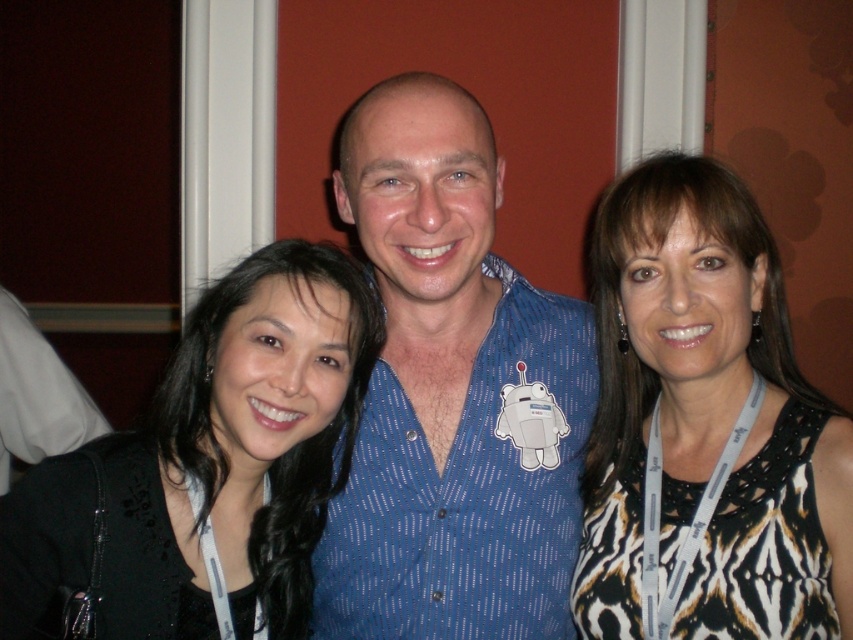
You are standing in front of the group photo and need to identify the clothing items. Which clothing item is positioned to the right of the other between the printed fabric dress at right and the black fabric at left?

The printed fabric dress at right is positioned to the right of the black fabric at left.

You are standing in front of a group photo and see the blue dotted shirt at center and the white fabric at left. Which one is positioned higher in the image?

The blue dotted shirt at center is located above the white fabric at left, so it is positioned higher in the image.

You are standing in front of a group photo of three people. The blue dotted shirt at center is represented by point (x=451, y=394). Can you determine the position of the blue dotted shirt at center relative to the other two people in the photo?

The blue dotted shirt at center is represented by point (x=451, y=394), which is the center position between the two women on the left and right sides of the image.